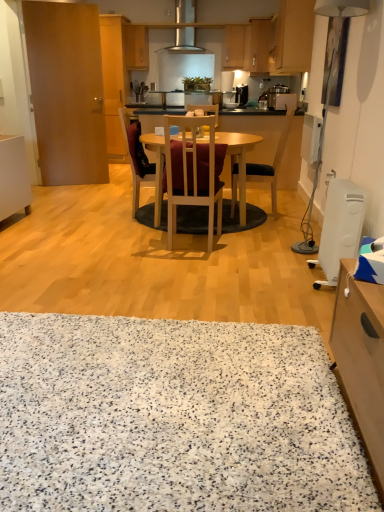
Identify the location of wooden cabinet at left, the second cabinetry in the left-to-right sequence. The width and height of the screenshot is (384, 512). (114, 82).

What is the approximate height of velvet maroon chair at center, which is counted as the 3th chair, starting from the right?

38.72 inches.

The width and height of the screenshot is (384, 512). What do you see at coordinates (192, 173) in the screenshot? I see `wooden chair at center, acting as the second chair starting from the right` at bounding box center [192, 173].

What do you see at coordinates (230, 105) in the screenshot? The width and height of the screenshot is (384, 512). I see `white glossy plate at center` at bounding box center [230, 105].

The height and width of the screenshot is (512, 384). Describe the element at coordinates (136, 47) in the screenshot. I see `matte wood cabinet at upper center, positioned as the fourth cabinetry in right-to-left order` at that location.

The image size is (384, 512). Describe the element at coordinates (293, 37) in the screenshot. I see `wooden cabinet at upper right, which ranks as the 6th cabinetry in left-to-right order` at that location.

The height and width of the screenshot is (512, 384). In order to click on wooden cabinet at left, the 3th cabinetry in the front-to-back sequence in this screenshot , I will do `click(114, 82)`.

From the image's perspective, is white matte cabinet at left, which ranks as the first cabinetry in left-to-right order, located beneath brown wooden door at left?

Yes.

There is a white matte cabinet at left, the 6th cabinetry viewed from the back. In order to click on door above it (from a real-world perspective) in this screenshot , I will do `click(67, 92)`.

Can you confirm if white matte cabinet at left, the 6th cabinetry viewed from the back, is smaller than brown wooden door at left?

Incorrect, white matte cabinet at left, the 6th cabinetry viewed from the back, is not smaller in size than brown wooden door at left.

How many degrees apart are the facing directions of white matte cabinet at left, the 6th cabinetry viewed from the back, and brown wooden door at left?

69.8 degrees separate the facing orientations of white matte cabinet at left, the 6th cabinetry viewed from the back, and brown wooden door at left.

Can you tell me how much wooden table at center and metallic silver picture frame at upper right differ in facing direction?

They differ by 90.2 degrees in their facing directions.

Is wooden table at center positioned with its back to metallic silver picture frame at upper right?

That's not correct — wooden table at center is not looking away from metallic silver picture frame at upper right.

From the image's perspective, is wooden table at center located above metallic silver picture frame at upper right?

No, from the image's perspective, wooden table at center is not above metallic silver picture frame at upper right.

Is wooden table at center next to metallic silver picture frame at upper right?

No, wooden table at center is not next to metallic silver picture frame at upper right.

Considering the points (245, 89) and (192, 80), which point is behind, point (245, 89) or point (192, 80)?

The point (192, 80) is farther.

Which object is further away from the camera, black plastic coffee machine at upper center or matte gold pot/pan at upper center?

Positioned behind is black plastic coffee machine at upper center.

Based on the photo, is black plastic coffee machine at upper center facing towards matte gold pot/pan at upper center?

Yes, black plastic coffee machine at upper center is aimed at matte gold pot/pan at upper center.

From the image's perspective, relative to matte gold pot/pan at upper center, is black plastic coffee machine at upper center above or below?

black plastic coffee machine at upper center is situated higher than matte gold pot/pan at upper center in the image.

Does point (197, 78) appear closer or farther from the camera than point (276, 34)?

Point (197, 78).

Is there a large distance between matte gold pot/pan at upper center and wooden cabinet at upper right, the 1th cabinetry positioned from the right?

Absolutely, matte gold pot/pan at upper center is distant from wooden cabinet at upper right, the 1th cabinetry positioned from the right.

Locate an element on the screen. The image size is (384, 512). pot/pan behind the wooden cabinet at upper right, the second cabinetry positioned from the front is located at coordinates (197, 83).

Considering their positions, is matte wood cabinet at upper center, positioned as the fourth cabinetry in right-to-left order, located in front of or behind brown wooden door at left?

matte wood cabinet at upper center, positioned as the fourth cabinetry in right-to-left order, is positioned farther from the viewer than brown wooden door at left.

Considering the relative sizes of matte wood cabinet at upper center, the sixth cabinetry viewed from the front, and brown wooden door at left in the image provided, is matte wood cabinet at upper center, the sixth cabinetry viewed from the front, taller than brown wooden door at left?

No, matte wood cabinet at upper center, the sixth cabinetry viewed from the front, is not taller than brown wooden door at left.

Is matte wood cabinet at upper center, arranged as the third cabinetry when viewed from the left, facing towards brown wooden door at left?

Yes, matte wood cabinet at upper center, arranged as the third cabinetry when viewed from the left, is oriented towards brown wooden door at left.

You are a GUI agent. You are given a task and a screenshot of the screen. Output one action in this format:
    pyautogui.click(x=<x>, y=<y>)
    Task: Click on the cabinetry that is the 5th object located above the brown wooden door at left (from the image's perspective)
    The height and width of the screenshot is (512, 384).
    Given the screenshot: What is the action you would take?
    pyautogui.click(x=136, y=47)

Does white matte cabinet at left, the sixth cabinetry when ordered from right to left, appear on the right side of wooden cabinet at left, positioned as the fifth cabinetry in right-to-left order?

In fact, white matte cabinet at left, the sixth cabinetry when ordered from right to left, is to the left of wooden cabinet at left, positioned as the fifth cabinetry in right-to-left order.

Looking at their sizes, would you say white matte cabinet at left, the 6th cabinetry viewed from the back, is wider or thinner than wooden cabinet at left, placed as the fourth cabinetry when sorted from back to front?

In the image, white matte cabinet at left, the 6th cabinetry viewed from the back, appears to be more narrow than wooden cabinet at left, placed as the fourth cabinetry when sorted from back to front.

Does white matte cabinet at left, placed as the first cabinetry when sorted from front to back, lie behind wooden cabinet at left, positioned as the fifth cabinetry in right-to-left order?

No, white matte cabinet at left, placed as the first cabinetry when sorted from front to back, is in front of wooden cabinet at left, positioned as the fifth cabinetry in right-to-left order.

From a real-world perspective, is brown wooden door at left located higher than white plastic lamp at right?

Yes, from a real-world perspective, brown wooden door at left is above white plastic lamp at right.

I want to click on door that is above the white plastic lamp at right (from a real-world perspective), so click(x=67, y=92).

Considering the relative positions of brown wooden door at left and white plastic lamp at right in the image provided, is brown wooden door at left to the left of white plastic lamp at right from the viewer's perspective?

Correct, you'll find brown wooden door at left to the left of white plastic lamp at right.

Where is `door above the white matte cabinet at left, placed as the first cabinetry when sorted from front to back (from a real-world perspective)`? door above the white matte cabinet at left, placed as the first cabinetry when sorted from front to back (from a real-world perspective) is located at coordinates (67, 92).

The width and height of the screenshot is (384, 512). Identify the location of desk that is under the metallic silver picture frame at upper right (from a real-world perspective). (239, 161).

Looking at the image, which one is located closer to black fabric chair at center, the third chair when ordered from left to right, white plastic lamp at right or black plastic coffee machine at upper center?

The object closer to black fabric chair at center, the third chair when ordered from left to right, is white plastic lamp at right.

Based on their spatial positions, is white speckled carpet at lower center or velvet maroon chair at center, which is counted as the 3th chair, starting from the right, closer to white plastic lamp at right?

Based on the image, velvet maroon chair at center, which is counted as the 3th chair, starting from the right, appears to be nearer to white plastic lamp at right.

Looking at the image, which one is located further to wooden cabinet at left, the second cabinetry in the left-to-right sequence, black felt mat at center or white glossy plate at center?

Among the two, black felt mat at center is located further to wooden cabinet at left, the second cabinetry in the left-to-right sequence.

Based on their spatial positions, is white glossy plate at center or matte wood cabinet at upper center, positioned as the 1th cabinetry in back-to-front order, further from white plastic heater at lower right, arranged as the 2th appliance when viewed from the back?

matte wood cabinet at upper center, positioned as the 1th cabinetry in back-to-front order.

Based on their spatial positions, is wooden table at center or white plastic lamp at right closer to wooden cabinet at upper right, the second cabinetry positioned from the front?

Based on the image, white plastic lamp at right appears to be nearer to wooden cabinet at upper right, the second cabinetry positioned from the front.

Estimate the real-world distances between objects in this image. Which object is further from satin silver coffee maker at upper center, arranged as the first appliance when viewed from the back, white plastic lamp at right or satin silver oven at upper center?

white plastic lamp at right.

Looking at the image, which one is located closer to satin silver oven at upper center, black felt mat at center or velvet maroon chair at center, which is counted as the 3th chair, starting from the right?

velvet maroon chair at center, which is counted as the 3th chair, starting from the right, lies closer to satin silver oven at upper center than the other object.

Which object lies nearer to the anchor point satin silver oven at upper center, black felt mat at center or black plastic coffee machine at upper center?

Among the two, black plastic coffee machine at upper center is located nearer to satin silver oven at upper center.

The image size is (384, 512). Find the location of `desk between satin silver oven at upper center and black felt mat at center in the up-down direction`. desk between satin silver oven at upper center and black felt mat at center in the up-down direction is located at coordinates (239, 161).

The image size is (384, 512). Find the location of `plate between wooden cabinet at left, positioned as the fifth cabinetry in right-to-left order, and black plastic coffee machine at upper center from left to right`. plate between wooden cabinet at left, positioned as the fifth cabinetry in right-to-left order, and black plastic coffee machine at upper center from left to right is located at coordinates (230, 105).

At what (x,y) coordinates should I click in order to perform the action: click on oven between white speckled carpet at lower center and black plastic coffee machine at upper center along the z-axis. Please return your answer as a coordinate pair (x, y). The width and height of the screenshot is (384, 512). Looking at the image, I should click on (185, 26).

Find the location of `desk between brown wooden door at left and white plastic heater at lower right, the 1th appliance ordered from the bottom, in the horizontal direction`. desk between brown wooden door at left and white plastic heater at lower right, the 1th appliance ordered from the bottom, in the horizontal direction is located at coordinates (239, 161).